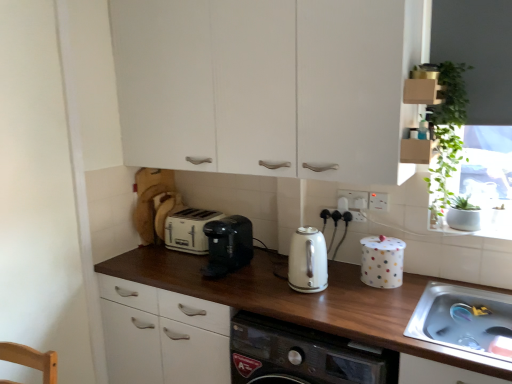
Question: Considering the relative sizes of white plastic socket at upper center, the 2th electric outlet in the right-to-left sequence, and white polka dot canister at right in the image provided, is white plastic socket at upper center, the 2th electric outlet in the right-to-left sequence, wider than white polka dot canister at right?

Choices:
 (A) yes
 (B) no

Answer: (B)

Question: Considering the relative sizes of white plastic socket at upper center, the 2th electric outlet in the right-to-left sequence, and white polka dot canister at right in the image provided, is white plastic socket at upper center, the 2th electric outlet in the right-to-left sequence, smaller than white polka dot canister at right?

Choices:
 (A) yes
 (B) no

Answer: (A)

Question: Is white plastic socket at upper center, the 2th electric outlet in the right-to-left sequence, positioned with its back to white polka dot canister at right?

Choices:
 (A) yes
 (B) no

Answer: (B)

Question: Is white polka dot canister at right surrounded by white plastic socket at upper center, the 2th electric outlet in the right-to-left sequence?

Choices:
 (A) no
 (B) yes

Answer: (A)

Question: Does white plastic socket at upper center, positioned as the 1th electric outlet in left-to-right order, appear on the left side of white polka dot canister at right?

Choices:
 (A) yes
 (B) no

Answer: (A)

Question: Considering the positions of stainless steel sink at lower right and green leafy plant at upper right in the image, is stainless steel sink at lower right wider or thinner than green leafy plant at upper right?

Choices:
 (A) thin
 (B) wide

Answer: (B)

Question: Considering the positions of stainless steel sink at lower right and green leafy plant at upper right in the image, is stainless steel sink at lower right taller or shorter than green leafy plant at upper right?

Choices:
 (A) tall
 (B) short

Answer: (B)

Question: In the image, is stainless steel sink at lower right on the left side or the right side of green leafy plant at upper right?

Choices:
 (A) left
 (B) right

Answer: (B)

Question: Relative to green leafy plant at upper right, is stainless steel sink at lower right in front or behind?

Choices:
 (A) front
 (B) behind

Answer: (A)

Question: From the image's perspective, relative to white polka dot canister at right, is white glossy kettle at center, positioned as the 1th kitchen appliance in right-to-left order, above or below?

Choices:
 (A) below
 (B) above

Answer: (B)

Question: Is point (296, 264) closer or farther from the camera than point (381, 246)?

Choices:
 (A) farther
 (B) closer

Answer: (B)

Question: Is white glossy kettle at center, arranged as the 2th kitchen appliance when viewed from the left, spatially inside white polka dot canister at right, or outside of it?

Choices:
 (A) inside
 (B) outside

Answer: (B)

Question: From a real-world perspective, is white glossy kettle at center, arranged as the 2th kitchen appliance when viewed from the left, positioned above or below white polka dot canister at right?

Choices:
 (A) below
 (B) above

Answer: (B)

Question: Is point (435, 304) closer or farther from the camera than point (131, 0)?

Choices:
 (A) farther
 (B) closer

Answer: (B)

Question: Is stainless steel sink at lower right in front of or behind white matte cabinet at upper center in the image?

Choices:
 (A) front
 (B) behind

Answer: (A)